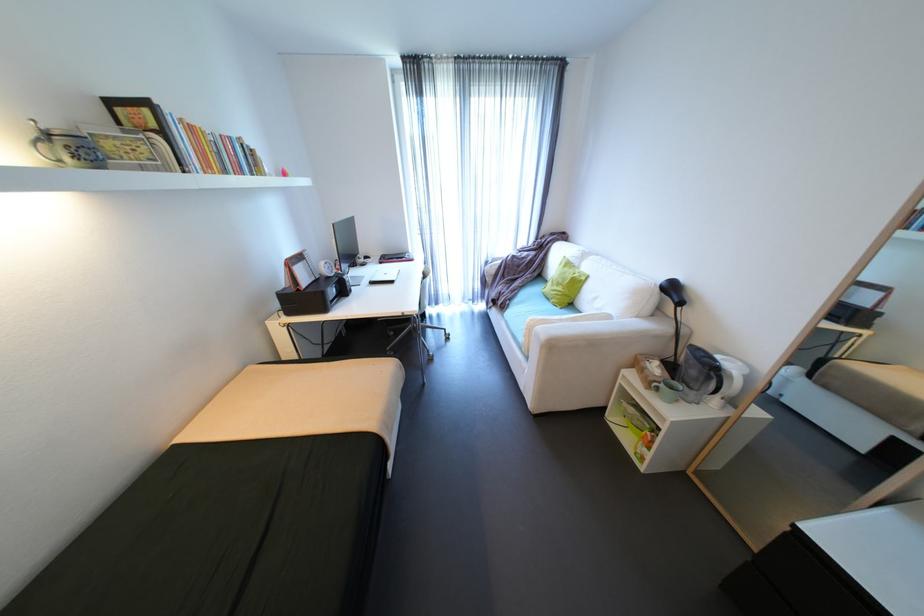
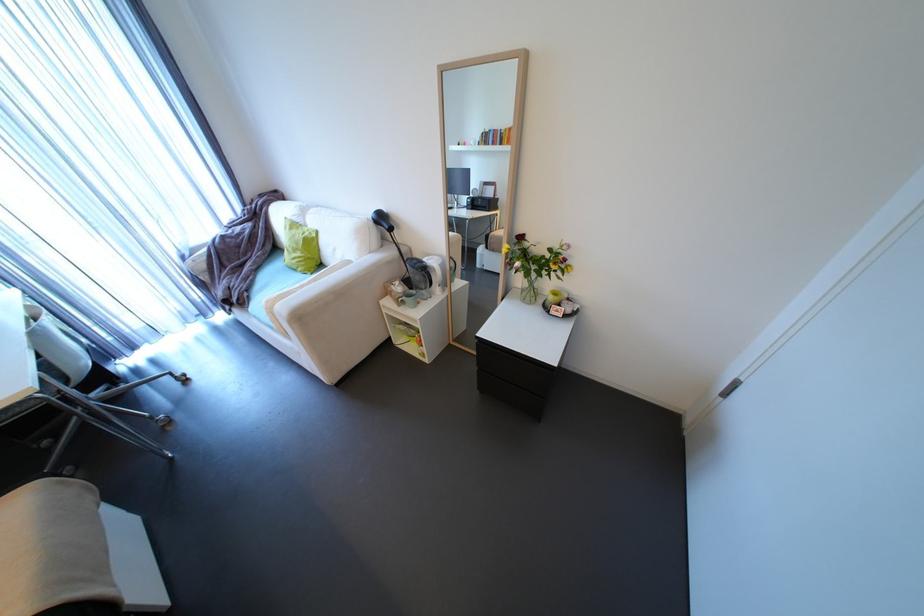
The point at (497, 262) is marked in the first image. Where is the corresponding point in the second image?

(195, 254)